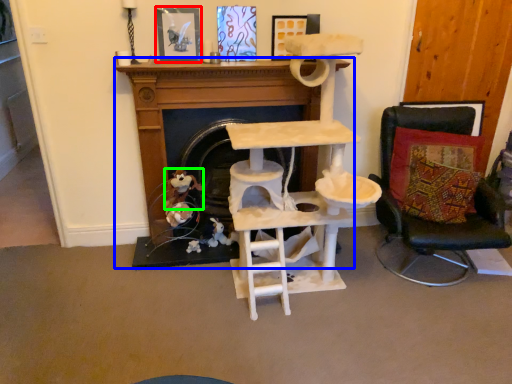
Question: Estimate the real-world distances between objects in this image. Which object is farther from picture frame (highlighted by a red box), fireplace (highlighted by a blue box) or toy (highlighted by a green box)?

Choices:
 (A) fireplace
 (B) toy

Answer: (B)